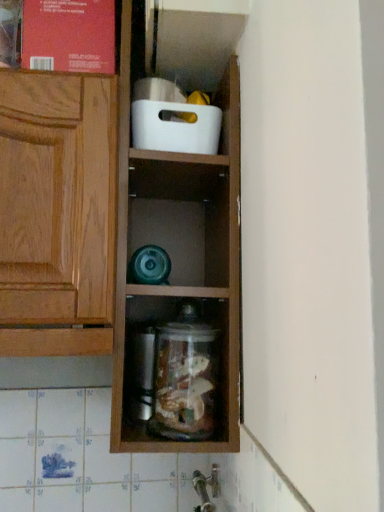
Question: Does clear glass jar at center have a lesser width compared to white plastic container at upper center?

Choices:
 (A) no
 (B) yes

Answer: (A)

Question: Is the surface of clear glass jar at center in direct contact with white plastic container at upper center?

Choices:
 (A) no
 (B) yes

Answer: (A)

Question: From a real-world perspective, does clear glass jar at center stand above white plastic container at upper center?

Choices:
 (A) no
 (B) yes

Answer: (A)

Question: Can you confirm if clear glass jar at center is smaller than white plastic container at upper center?

Choices:
 (A) yes
 (B) no

Answer: (B)

Question: Considering the relative sizes of clear glass jar at center and white plastic container at upper center in the image provided, is clear glass jar at center shorter than white plastic container at upper center?

Choices:
 (A) no
 (B) yes

Answer: (A)

Question: Are clear glass jar at center and white plastic container at upper center located far from each other?

Choices:
 (A) yes
 (B) no

Answer: (B)

Question: Is clear glass jar at center located outside silver metallic faucet at lower center?

Choices:
 (A) yes
 (B) no

Answer: (A)

Question: Does clear glass jar at center have a lesser width compared to silver metallic faucet at lower center?

Choices:
 (A) no
 (B) yes

Answer: (A)

Question: From the image's perspective, is clear glass jar at center on top of silver metallic faucet at lower center?

Choices:
 (A) yes
 (B) no

Answer: (A)

Question: Is clear glass jar at center at the right side of silver metallic faucet at lower center?

Choices:
 (A) no
 (B) yes

Answer: (A)

Question: Can silver metallic faucet at lower center be found inside clear glass jar at center?

Choices:
 (A) yes
 (B) no

Answer: (B)

Question: From a real-world perspective, is clear glass jar at center on top of silver metallic faucet at lower center?

Choices:
 (A) no
 (B) yes

Answer: (B)

Question: Is matte red book at upper left facing towards white plastic container at upper center?

Choices:
 (A) no
 (B) yes

Answer: (A)